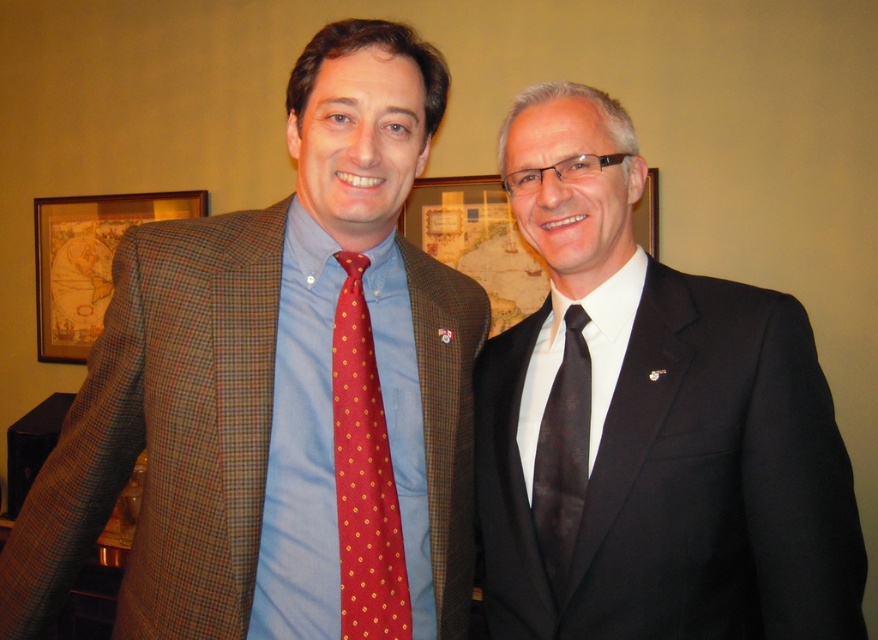
Does red dotted tie at left lie behind black silk tie at right?

No, red dotted tie at left is closer to the viewer.

Who is shorter, red dotted tie at left or black silk tie at right?

black silk tie at right is shorter.

Who is more distant from viewer, (389,541) or (543,534)?

Positioned behind is point (543,534).

Where is `red dotted tie at left`? red dotted tie at left is located at coordinates (364, 476).

Which is above, matte black suit at right or wooden frame at upper left?

wooden frame at upper left is above.

Is point (702, 470) positioned after point (42, 212)?

No, it is not.

The width and height of the screenshot is (878, 640). Identify the location of matte black suit at right. (651, 426).

Is black glossy suit at right below black silk tie at right?

No.

Does black glossy suit at right appear over black silk tie at right?

Correct, black glossy suit at right is located above black silk tie at right.

Between point (533, 282) and point (551, 490), which one is positioned behind?

Positioned behind is point (533, 282).

Identify the location of black glossy suit at right. This screenshot has width=878, height=640. (476, 241).